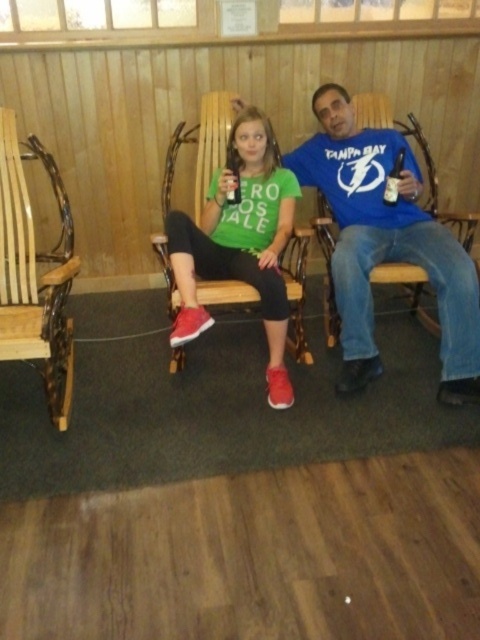
Question: From the image, what is the correct spatial relationship of matte green t-shirt at center in relation to clear plastic bottle at right?

Choices:
 (A) right
 (B) left

Answer: (B)

Question: Which point is closer to the camera?

Choices:
 (A) clear plastic bottle at right
 (B) wooden chair at left

Answer: (B)

Question: Observing the image, what is the correct spatial positioning of matte green t-shirt at center in reference to clear plastic bottle at right?

Choices:
 (A) below
 (B) above

Answer: (A)

Question: Is wooden chair at left in front of clear plastic bottle at right?

Choices:
 (A) no
 (B) yes

Answer: (B)

Question: Which point is closer to the camera?

Choices:
 (A) (25, 282)
 (B) (191, 307)

Answer: (B)

Question: Estimate the real-world distances between objects in this image. Which object is farther from the clear plastic bottle at right?

Choices:
 (A) matte green t-shirt at center
 (B) blue cotton shirt at center

Answer: (A)